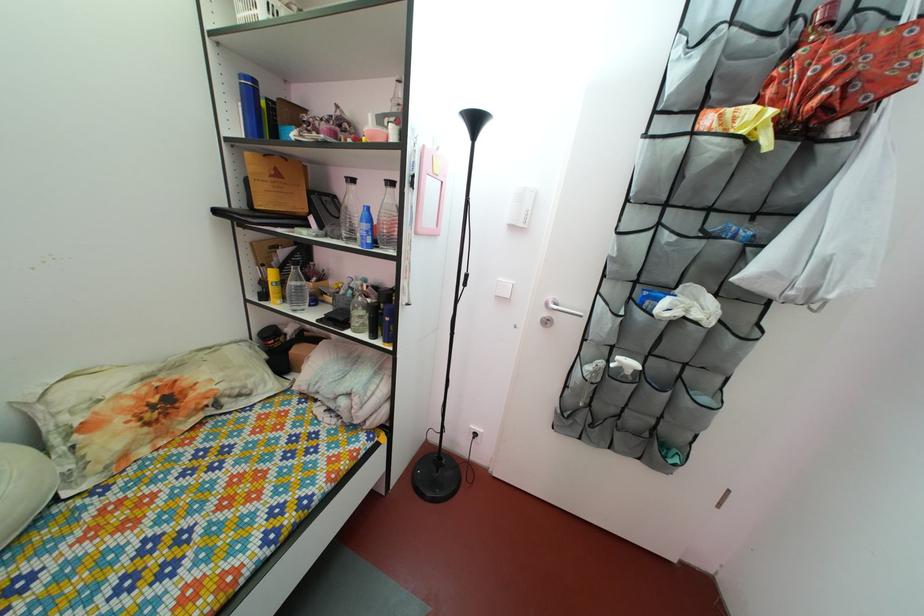
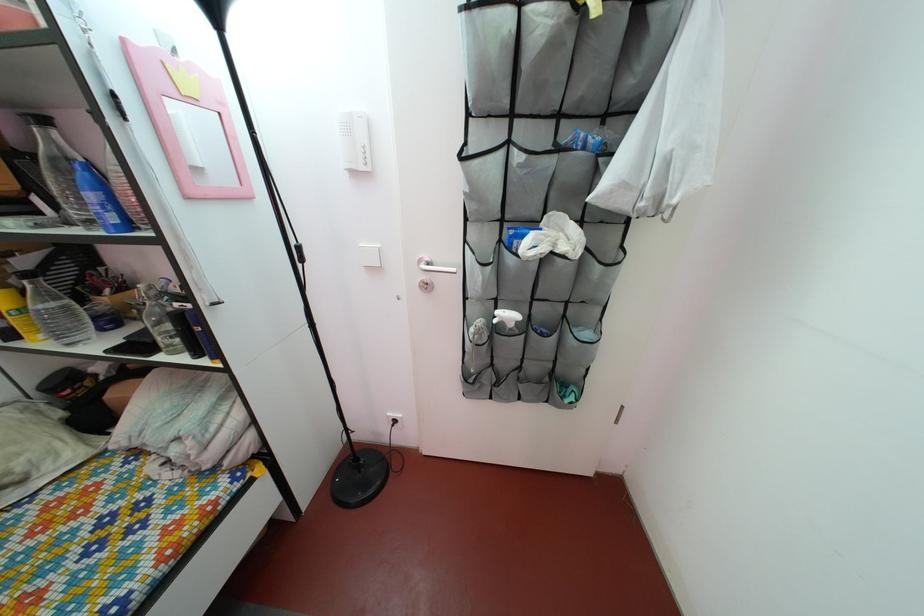
Find the pixel in the second image that matches pixel 834 257 in the first image.

(675, 152)